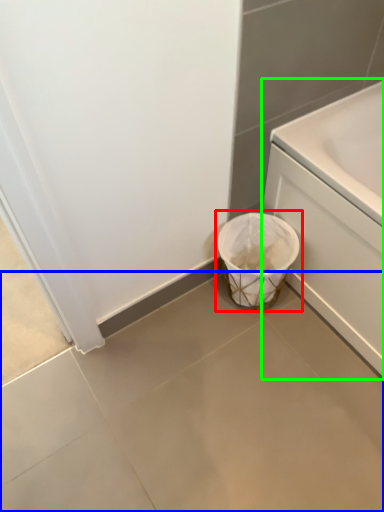
Question: Which is nearer to the waste container (highlighted by a red box)? concrete (highlighted by a blue box) or bath (highlighted by a green box).

Choices:
 (A) concrete
 (B) bath

Answer: (B)